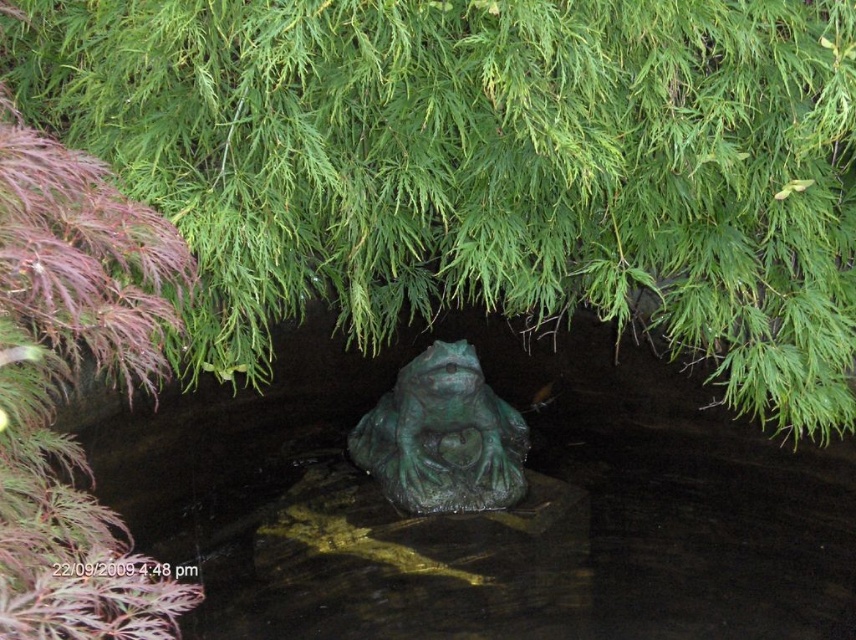
You are standing in the garden and want to place a small decorative item between the purple leafy plant at left and the frog statue. Based on their positions, where should you place the item to ensure it is centered between them?

The purple leafy plant at left is located at point (64, 376), so you should place the item halfway between the two coordinates to center it between them.

You are standing in the garden and want to take a photo of both the green matte tree at center and the purple leafy plant at left. Which one should you adjust your camera angle to focus on first if you want to capture them both in the same frame?

You should focus on the purple leafy plant at left first because the green matte tree at center is to the right of it, so adjusting your angle to include both would require starting with the one on the left.

You are a gardener who wants to place a new decorative stone in the garden. You see the green matte tree at center and the green patina stone frog at center. Which object is located above the other?

The green matte tree at center is positioned over green patina stone frog at center, so the green matte tree at center is above the frog.